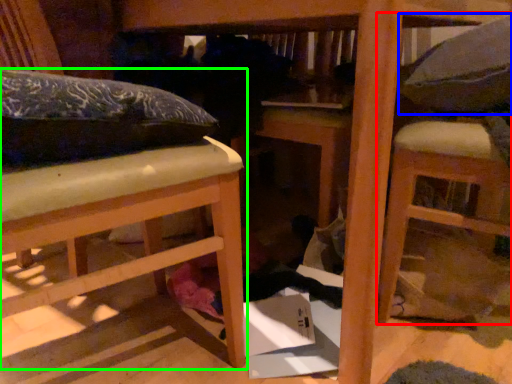
Question: Estimate the real-world distances between objects in this image. Which object is closer to furniture (highlighted by a red box), pillow (highlighted by a blue box) or furniture (highlighted by a green box)?

Choices:
 (A) pillow
 (B) furniture

Answer: (A)